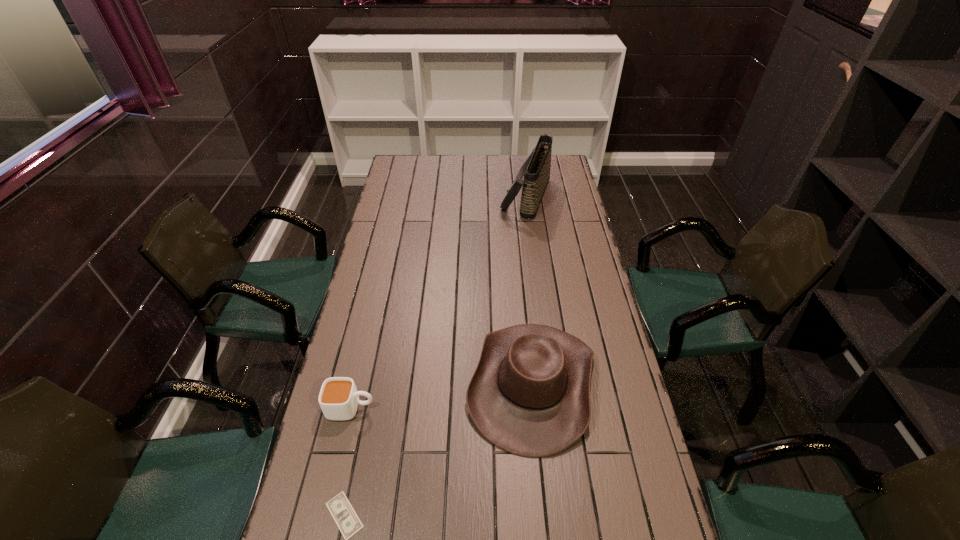
The width and height of the screenshot is (960, 540). I want to click on cowboy hat located in the right edge section of the desktop, so click(x=530, y=393).

Locate an element on the screen. This screenshot has height=540, width=960. object that is at the far right corner is located at coordinates (536, 170).

The height and width of the screenshot is (540, 960). Find the location of `vacant space at the far edge`. vacant space at the far edge is located at coordinates (495, 168).

I want to click on vacant region at the left edge, so click(x=382, y=305).

In the image, there is a desktop. Where is `free space at the right edge`? free space at the right edge is located at coordinates (557, 239).

The height and width of the screenshot is (540, 960). In the image, there is a desktop. In order to click on free space at the far left corner in this screenshot , I will do `click(403, 179)`.

This screenshot has width=960, height=540. I want to click on empty space between the second shortest object and the third shortest object, so click(x=442, y=395).

Locate an element on the screen. The height and width of the screenshot is (540, 960). free spot between the cup and the cowboy hat is located at coordinates (442, 395).

The image size is (960, 540). Find the location of `free space between the second tallest object and the second shortest object`. free space between the second tallest object and the second shortest object is located at coordinates (442, 395).

Image resolution: width=960 pixels, height=540 pixels. I want to click on vacant area that lies between the third shortest object and the tallest object, so click(x=529, y=289).